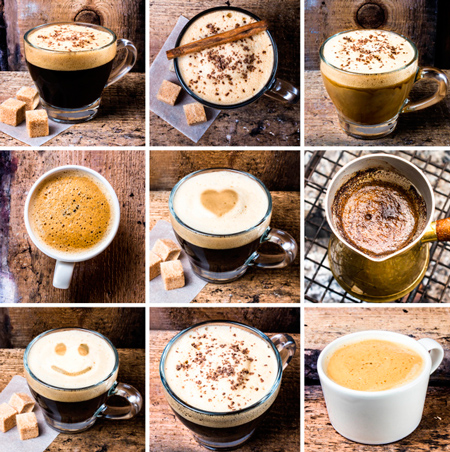
Identify the location of photo on edge of collage array. click(60, 69), click(231, 82), click(362, 71), click(384, 206), click(367, 367), click(233, 361), click(65, 356), click(72, 223).